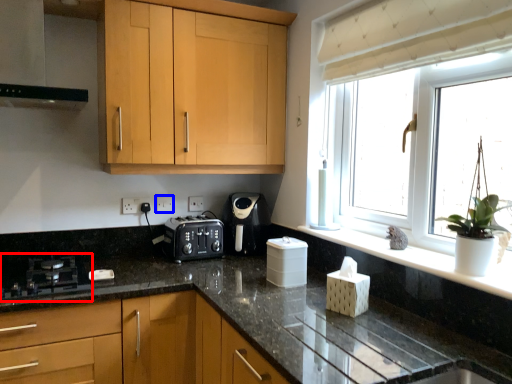
Question: Which object is further to the camera taking this photo, gas stove (highlighted by a red box) or electric outlet (highlighted by a blue box)?

Choices:
 (A) gas stove
 (B) electric outlet

Answer: (B)